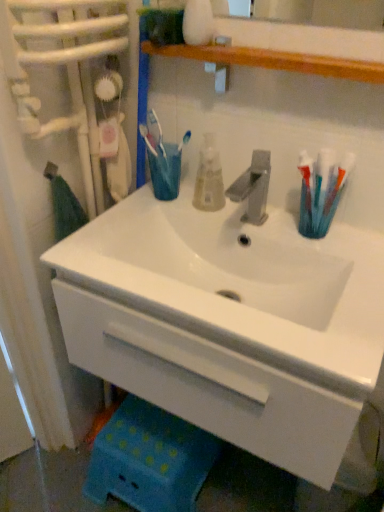
Question: Is white glossy sink at center shorter than translucent plastic toothbrushes at right?

Choices:
 (A) yes
 (B) no

Answer: (B)

Question: From the image's perspective, would you say white glossy sink at center is shown under translucent plastic toothbrushes at right?

Choices:
 (A) no
 (B) yes

Answer: (B)

Question: Can you confirm if white glossy sink at center is wider than translucent plastic toothbrushes at right?

Choices:
 (A) yes
 (B) no

Answer: (A)

Question: Does white glossy sink at center have a smaller size compared to translucent plastic toothbrushes at right?

Choices:
 (A) no
 (B) yes

Answer: (A)

Question: From a real-world perspective, is white glossy sink at center over translucent plastic toothbrushes at right?

Choices:
 (A) no
 (B) yes

Answer: (A)

Question: Relative to white glossy sink at center, is translucent plastic toothbrushes at right in front or behind?

Choices:
 (A) behind
 (B) front

Answer: (A)

Question: Based on their sizes in the image, would you say translucent plastic toothbrushes at right is bigger or smaller than white glossy sink at center?

Choices:
 (A) big
 (B) small

Answer: (B)

Question: Would you say translucent plastic toothbrushes at right is inside or outside white glossy sink at center?

Choices:
 (A) outside
 (B) inside

Answer: (A)

Question: Is point (349, 165) closer or farther from the camera than point (258, 337)?

Choices:
 (A) farther
 (B) closer

Answer: (A)

Question: Is point click(x=314, y=457) closer or farther from the camera than point click(x=329, y=190)?

Choices:
 (A) farther
 (B) closer

Answer: (B)

Question: From a real-world perspective, is white glossy sink at center physically located above or below translucent plastic toothbrushes at right?

Choices:
 (A) below
 (B) above

Answer: (A)

Question: From their relative heights in the image, would you say white glossy sink at center is taller or shorter than translucent plastic toothbrushes at right?

Choices:
 (A) tall
 (B) short

Answer: (A)

Question: From the image's perspective, is white glossy sink at center located above or below translucent plastic toothbrushes at right?

Choices:
 (A) below
 (B) above

Answer: (A)

Question: Looking at the image, does white glossy sink at center seem bigger or smaller compared to translucent plastic mouthwash at center?

Choices:
 (A) small
 (B) big

Answer: (B)

Question: From a real-world perspective, is white glossy sink at center above or below translucent plastic mouthwash at center?

Choices:
 (A) below
 (B) above

Answer: (A)